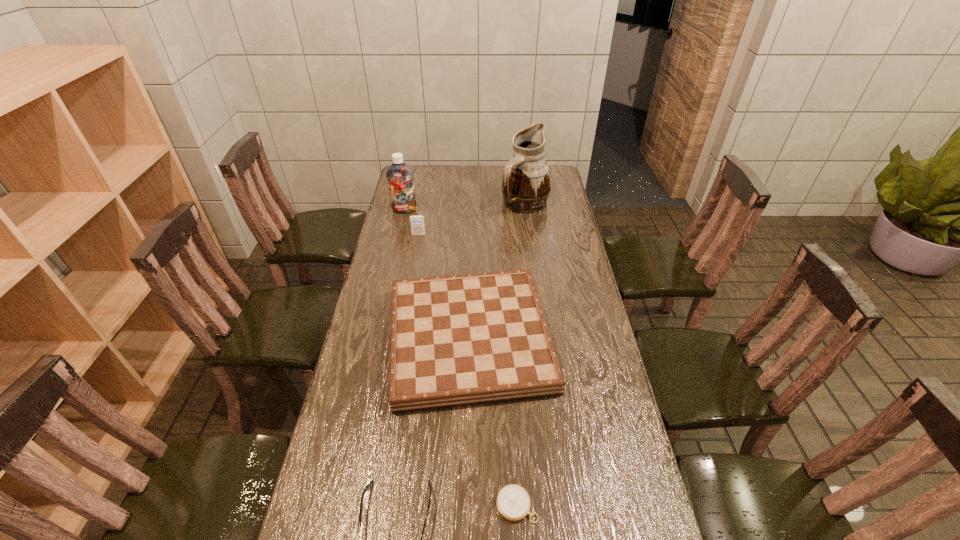
Find the location of a particular element. This screenshot has height=540, width=960. vacant space at the right edge of the desktop is located at coordinates (584, 301).

Identify the location of free spot between the tallest object and the second tallest object. (465, 207).

Where is `empty location between the tallest object and the shampoo`? The height and width of the screenshot is (540, 960). empty location between the tallest object and the shampoo is located at coordinates (465, 207).

The image size is (960, 540). I want to click on vacant region between the fourth farthest object and the second tallest object, so click(437, 274).

The height and width of the screenshot is (540, 960). I want to click on the second closest object to the pitcher, so click(399, 175).

Identify which object is located as the fifth nearest to the fifth tallest object. Please provide its 2D coordinates. Your answer should be formatted as a tuple, i.e. [(x, y)], where the tuple contains the x and y coordinates of a point satisfying the conditions above.

[(526, 186)]

This screenshot has height=540, width=960. I want to click on free region that satisfies the following two spatial constraints: 1. on the front-facing side of the gameboard; 2. on the right side of the iPod, so click(x=401, y=339).

The height and width of the screenshot is (540, 960). I want to click on free space that satisfies the following two spatial constraints: 1. on the front-facing side of the iPod; 2. on the left side of the shortest object, so click(x=372, y=505).

The width and height of the screenshot is (960, 540). What are the coordinates of `vacant region that satisfies the following two spatial constraints: 1. on the front label of the shampoo; 2. on the left side of the fourth tallest object` in the screenshot? It's located at (375, 339).

Where is `free space that satisfies the following two spatial constraints: 1. on the front label of the gameboard; 2. on the right side of the sixth shortest object`? The width and height of the screenshot is (960, 540). free space that satisfies the following two spatial constraints: 1. on the front label of the gameboard; 2. on the right side of the sixth shortest object is located at coordinates (375, 339).